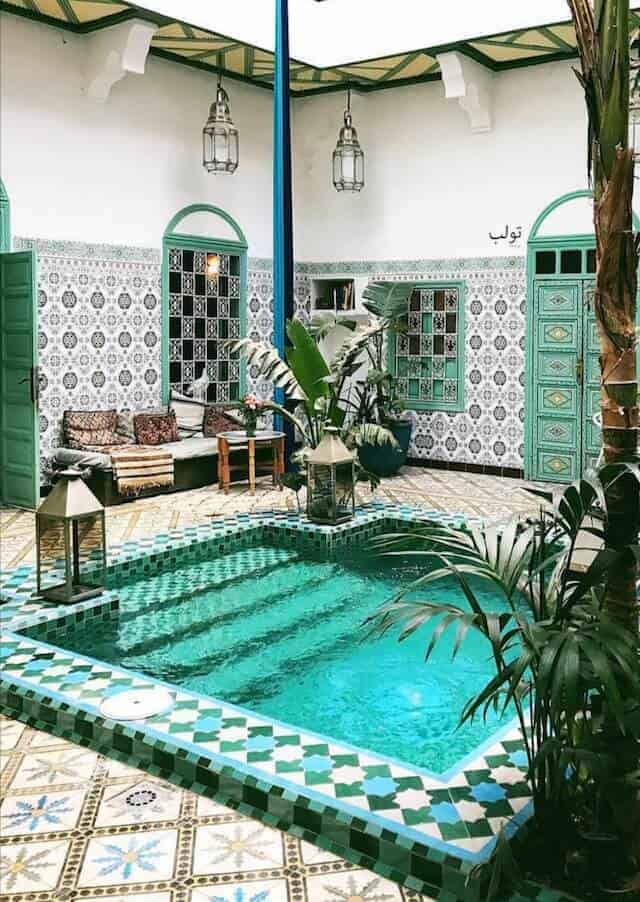
You are a GUI agent. You are given a task and a screenshot of the screen. Output one action in this format:
    pyautogui.click(x=<x>, y=<y>)
    Task: Click on the table legs
    The height and width of the screenshot is (902, 640).
    Given the screenshot: What is the action you would take?
    pyautogui.click(x=251, y=458), pyautogui.click(x=223, y=459), pyautogui.click(x=280, y=458), pyautogui.click(x=275, y=451), pyautogui.click(x=219, y=472)